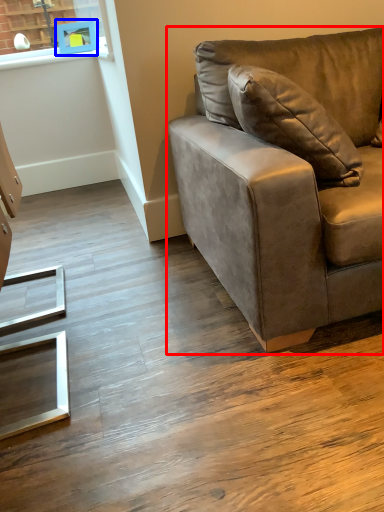
Question: Which object is further to the camera taking this photo, studio couch (highlighted by a red box) or picture frame (highlighted by a blue box)?

Choices:
 (A) studio couch
 (B) picture frame

Answer: (B)